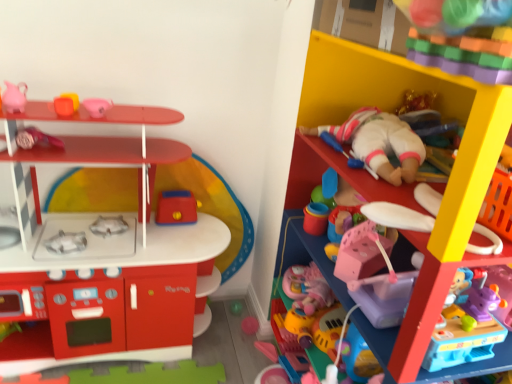
Question: From a real-world perspective, does rubberized red toaster at center, the fourth toy positioned from the right, stand above pink matte pitcher at upper left, the ninth toy positioned from the right?

Choices:
 (A) no
 (B) yes

Answer: (A)

Question: Can you confirm if rubberized red toaster at center, the sixth toy in the left-to-right sequence, is taller than pink matte pitcher at upper left, the ninth toy positioned from the right?

Choices:
 (A) no
 (B) yes

Answer: (B)

Question: Does rubberized red toaster at center, the fourth toy positioned from the right, have a larger size compared to pink matte pitcher at upper left, the ninth toy positioned from the right?

Choices:
 (A) no
 (B) yes

Answer: (B)

Question: From a real-world perspective, is rubberized red toaster at center, the fourth toy positioned from the right, beneath pink matte pitcher at upper left, which is the 1th toy in left-to-right order?

Choices:
 (A) no
 (B) yes

Answer: (B)

Question: Could you tell me if rubberized red toaster at center, the sixth toy in the left-to-right sequence, is facing pink matte pitcher at upper left, which is the 1th toy in left-to-right order?

Choices:
 (A) yes
 (B) no

Answer: (B)

Question: From a real-world perspective, is matte plastic play kitchen at left, arranged as the 6th toy when viewed from the right, physically located above or below pink rubber duck at upper left, acting as the 5th toy starting from the right?

Choices:
 (A) below
 (B) above

Answer: (A)

Question: Is matte plastic play kitchen at left, arranged as the 6th toy when viewed from the right, inside or outside of pink rubber duck at upper left, acting as the 5th toy starting from the right?

Choices:
 (A) inside
 (B) outside

Answer: (B)

Question: In terms of height, does matte plastic play kitchen at left, the fourth toy from the left, look taller or shorter compared to pink rubber duck at upper left, placed as the fifth toy when sorted from left to right?

Choices:
 (A) short
 (B) tall

Answer: (B)

Question: Considering their positions, is matte plastic play kitchen at left, arranged as the 6th toy when viewed from the right, located in front of or behind pink rubber duck at upper left, placed as the fifth toy when sorted from left to right?

Choices:
 (A) behind
 (B) front

Answer: (B)

Question: Would you say pink matte pitcher at upper left, which is the 1th toy in left-to-right order, is to the left or to the right of matte pink hairbrush at upper left, which appears as the 8th toy when viewed from the right, in the picture?

Choices:
 (A) right
 (B) left

Answer: (B)

Question: Is pink matte pitcher at upper left, the ninth toy positioned from the right, situated inside matte pink hairbrush at upper left, which appears as the 8th toy when viewed from the right, or outside?

Choices:
 (A) outside
 (B) inside

Answer: (A)

Question: From a real-world perspective, relative to matte pink hairbrush at upper left, the second toy from the left, is pink matte pitcher at upper left, which is the 1th toy in left-to-right order, vertically above or below?

Choices:
 (A) above
 (B) below

Answer: (A)

Question: From the image's perspective, is pink matte pitcher at upper left, which is the 1th toy in left-to-right order, positioned above or below matte pink hairbrush at upper left, which appears as the 8th toy when viewed from the right?

Choices:
 (A) below
 (B) above

Answer: (B)

Question: From a real-world perspective, is matte plastic play kitchen at left, arranged as the 6th toy when viewed from the right, above or below white plastic spoon at upper right, acting as the 8th toy starting from the left?

Choices:
 (A) above
 (B) below

Answer: (B)

Question: Is point (197, 246) positioned closer to the camera than point (486, 246)?

Choices:
 (A) farther
 (B) closer

Answer: (A)